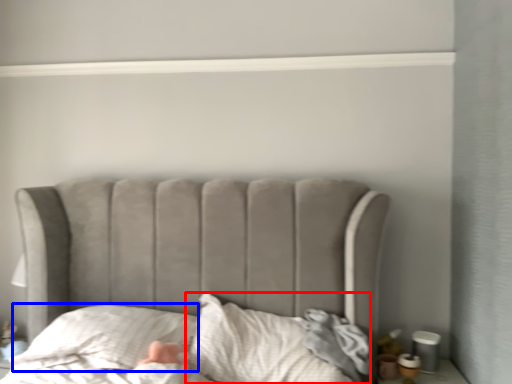
Question: Among these objects, which one is nearest to the camera, sheet (highlighted by a red box) or throw pillow (highlighted by a blue box)?

Choices:
 (A) sheet
 (B) throw pillow

Answer: (A)